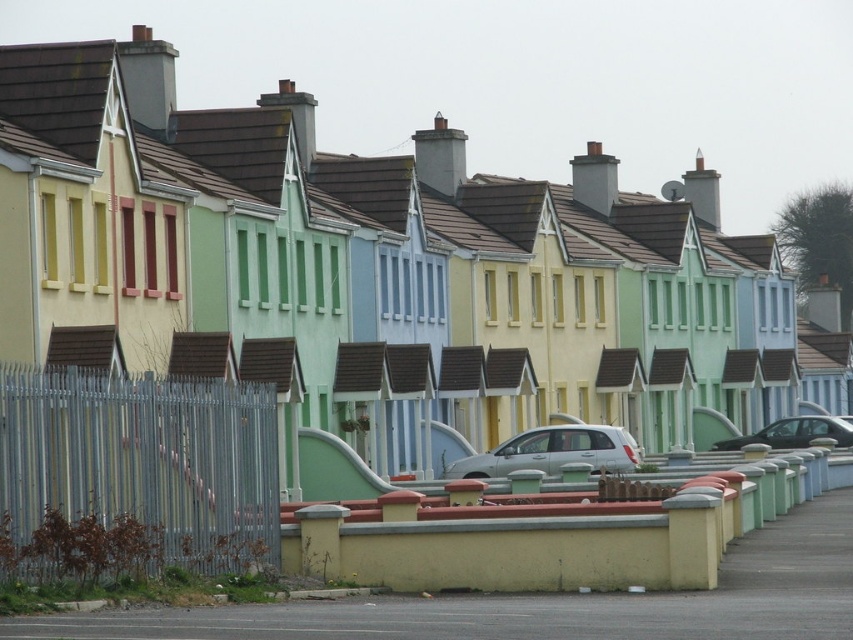
Question: Estimate the real-world distances between objects in this image. Which object is closer to the yellow matte wall at center?

Choices:
 (A) shiny black car at center
 (B) white matte car at center
 (C) metallic silver fence at left

Answer: (C)

Question: Estimate the real-world distances between objects in this image. Which object is closer to the yellow matte wall at center?

Choices:
 (A) metallic silver fence at left
 (B) shiny black car at center

Answer: (A)

Question: In this image, where is metallic silver fence at left located relative to yellow matte wall at center?

Choices:
 (A) left
 (B) right

Answer: (A)

Question: Which point is farther to the camera?

Choices:
 (A) (613, 465)
 (B) (701, 548)

Answer: (A)

Question: Can you confirm if white matte car at center is wider than shiny black car at center?

Choices:
 (A) no
 (B) yes

Answer: (B)

Question: Is metallic silver fence at left above shiny black car at center?

Choices:
 (A) yes
 (B) no

Answer: (A)